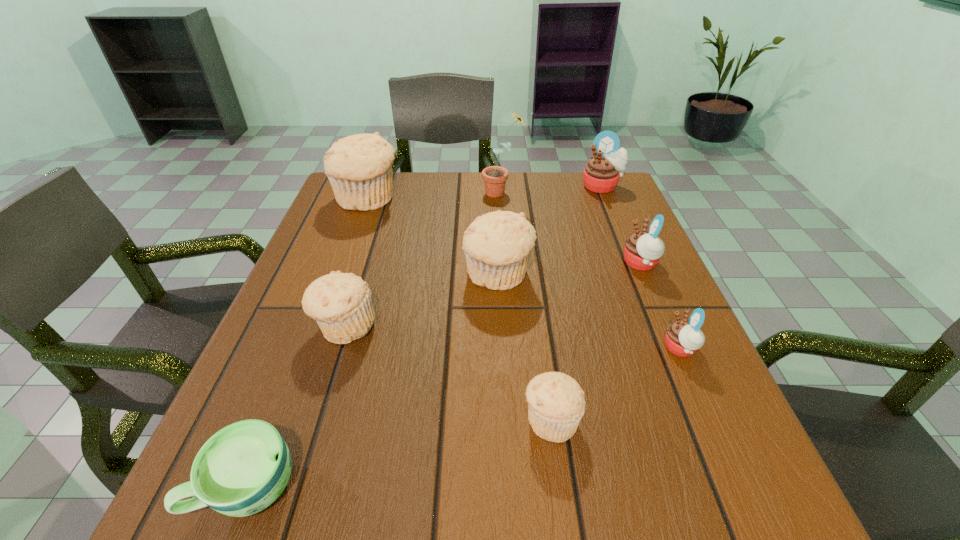
Image resolution: width=960 pixels, height=540 pixels. Find the location of `unoccupied position between the cup and the second biggest pink muffin`. unoccupied position between the cup and the second biggest pink muffin is located at coordinates (444, 375).

Locate an element on the screen. free point between the second biggest pink muffin and the sunflower is located at coordinates (571, 228).

This screenshot has width=960, height=540. Identify the location of free spot between the third biggest beige muffin and the blue cup. (297, 407).

The height and width of the screenshot is (540, 960). What are the coordinates of `free space between the farthest beige muffin and the nearest beige muffin` in the screenshot? It's located at (459, 309).

Where is `vacant region between the second biggest beige muffin and the farthest pink muffin`? vacant region between the second biggest beige muffin and the farthest pink muffin is located at coordinates (550, 231).

Find the location of a particular element. This screenshot has width=960, height=540. empty space between the third smallest beige muffin and the smallest pink muffin is located at coordinates (588, 312).

Locate an element on the screen. This screenshot has width=960, height=540. vacant point located between the second smallest pink muffin and the biggest pink muffin is located at coordinates (621, 225).

Select which object is the fifth closest to the second nearest object. Please provide its 2D coordinates. Your answer should be formatted as a tuple, i.e. [(x, y)], where the tuple contains the x and y coordinates of a point satisfying the conditions above.

[(642, 251)]

Find the location of `object that stands as the third closest to the farthest pink muffin`. object that stands as the third closest to the farthest pink muffin is located at coordinates (497, 245).

Identify which muffin is the fourth nearest to the nearest pink muffin. Please provide its 2D coordinates. Your answer should be formatted as a tuple, i.e. [(x, y)], where the tuple contains the x and y coordinates of a point satisfying the conditions above.

[(602, 172)]